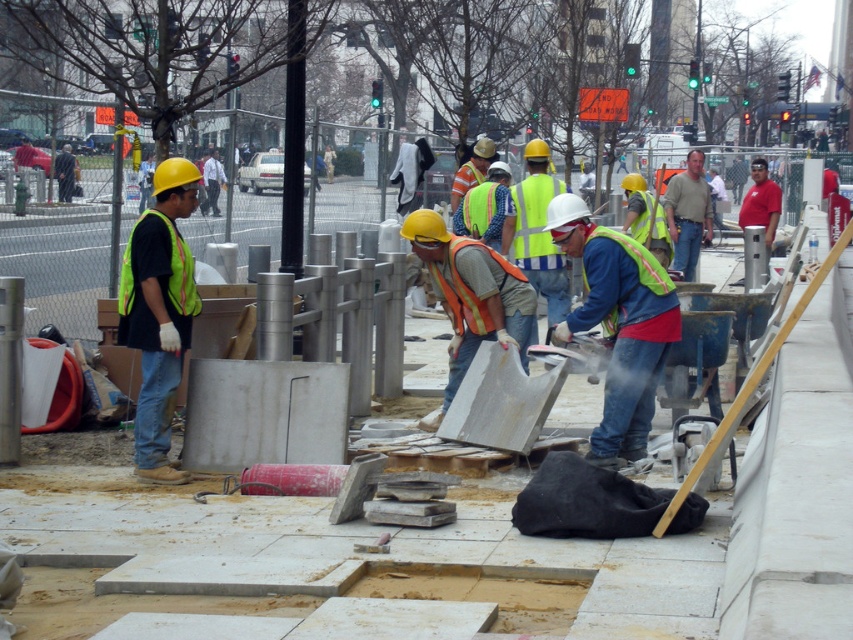
Question: Which of these objects is positioned closest to the matte yellow hard hat at left?

Choices:
 (A) high visibility yellow-green safety vest at left
 (B) matte khaki shirt at center

Answer: (A)

Question: Can you confirm if red reflective vest at center is wider than reflective yellow safety vest at center?

Choices:
 (A) yes
 (B) no

Answer: (A)

Question: Based on their relative distances, which object is nearer to the red reflective vest at center?

Choices:
 (A) matte khaki shirt at center
 (B) dark gray jacket at upper left
 (C) reflective yellow-green safety vest at center

Answer: (A)

Question: Does reflective yellow-green safety vest at center appear on the right side of red reflective vest at center?

Choices:
 (A) yes
 (B) no

Answer: (B)

Question: Can you confirm if high visibility yellow-green safety vest at left is bigger than reflective yellow safety vest at center?

Choices:
 (A) no
 (B) yes

Answer: (B)

Question: Which object is closer to the camera taking this photo?

Choices:
 (A) orange reflective vest at center
 (B) high visibility yellow-green safety vest at left

Answer: (B)